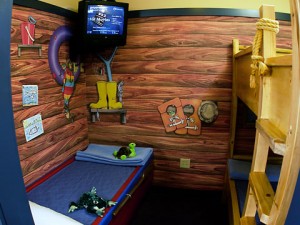
Where is `1 lower bed`? The height and width of the screenshot is (225, 300). 1 lower bed is located at coordinates (239, 190).